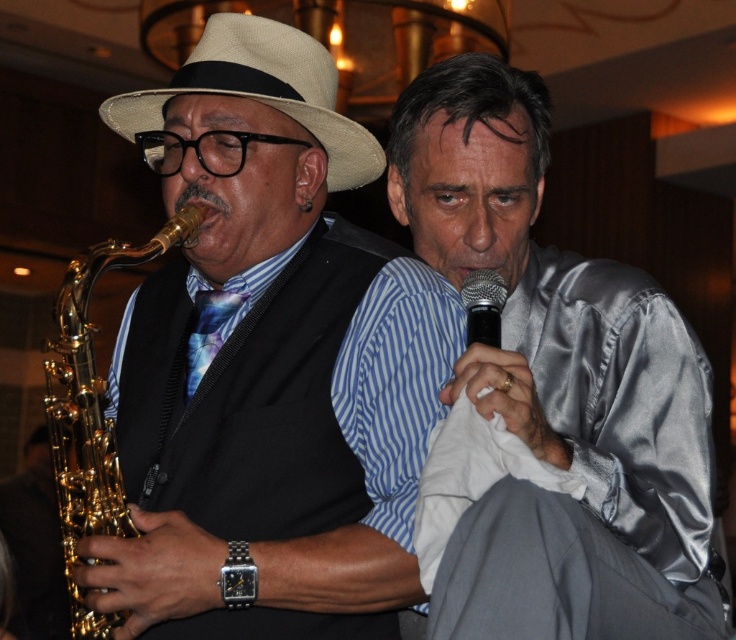
You are a photographer trying to capture the silver satin shirt at right. The scene has a point of interest at coordinate point (559, 388). Where should you aim your camera to capture the silver satin shirt at right?

The point of interest at coordinate point (559, 388) indicates the location of the silver satin shirt at right. Aim your camera at that coordinate to capture it.